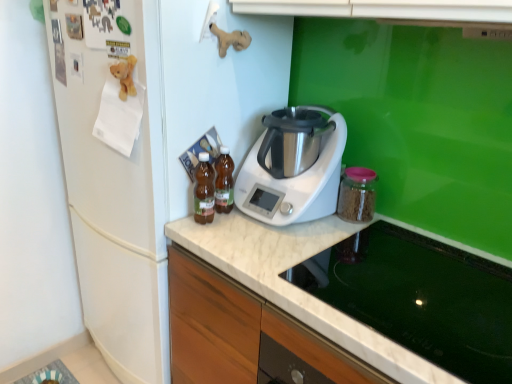
At what (x,y) coordinates should I click in order to perform the action: click on free space on the front side of translucent glass bottles at center, acting as the 2th kitchen appliance starting from the left. Please return your answer as a coordinate pair (x, y). Looking at the image, I should click on (228, 235).